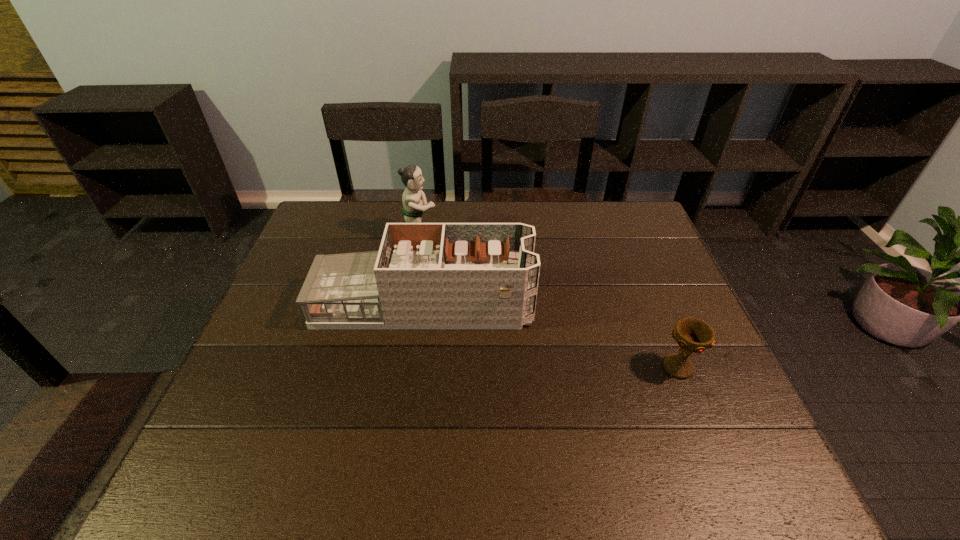
Image resolution: width=960 pixels, height=540 pixels. In order to click on object located in the left edge section of the desktop in this screenshot , I will do (425, 275).

You are a GUI agent. You are given a task and a screenshot of the screen. Output one action in this format:
    pyautogui.click(x=<x>, y=<y>)
    Task: Click on the object situated at the right edge
    This screenshot has width=960, height=540.
    Given the screenshot: What is the action you would take?
    click(x=693, y=335)

Identify the location of blank space at the far edge. The width and height of the screenshot is (960, 540). (595, 217).

At what (x,y) coordinates should I click in order to perform the action: click on blank space at the near edge of the desktop. Please return your answer as a coordinate pair (x, y). Image resolution: width=960 pixels, height=540 pixels. Looking at the image, I should click on (318, 446).

In the image, there is a desktop. Where is `free space at the left edge`? free space at the left edge is located at coordinates (212, 431).

Locate an element on the screen. vacant space at the right edge of the desktop is located at coordinates (654, 332).

The height and width of the screenshot is (540, 960). Find the location of `vacant space at the far left corner of the desktop`. vacant space at the far left corner of the desktop is located at coordinates (314, 213).

In the image, there is a desktop. Where is `vacant space at the far right corner`? This screenshot has width=960, height=540. vacant space at the far right corner is located at coordinates (647, 220).

This screenshot has height=540, width=960. I want to click on vacant space at the near right corner, so pyautogui.click(x=709, y=449).

You are a GUI agent. You are given a task and a screenshot of the screen. Output one action in this format:
    pyautogui.click(x=<x>, y=<y>)
    Task: Click on the unoccupied area between the rightmost object and the second shortest object
    
    Given the screenshot: What is the action you would take?
    pyautogui.click(x=551, y=336)